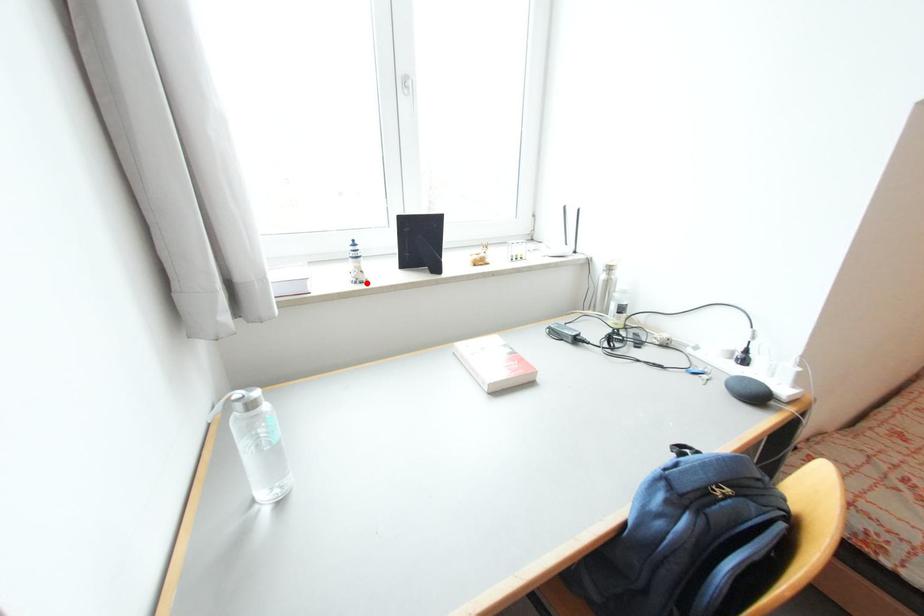
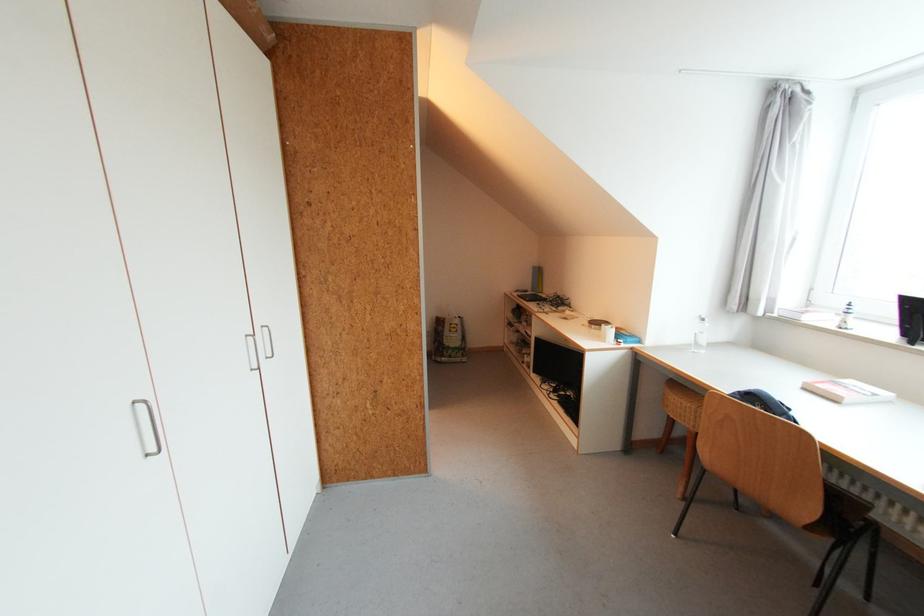
The point at the highlighted location is marked in the first image. Where is the corresponding point in the second image?

(845, 329)